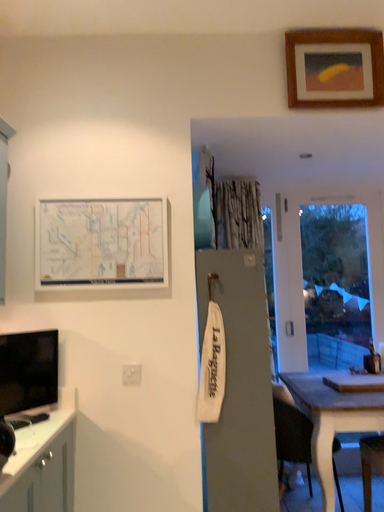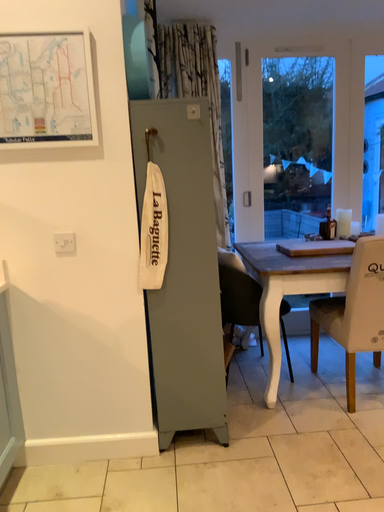
Question: How did the camera likely rotate when shooting the video?

Choices:
 (A) rotated downward
 (B) rotated upward

Answer: (A)